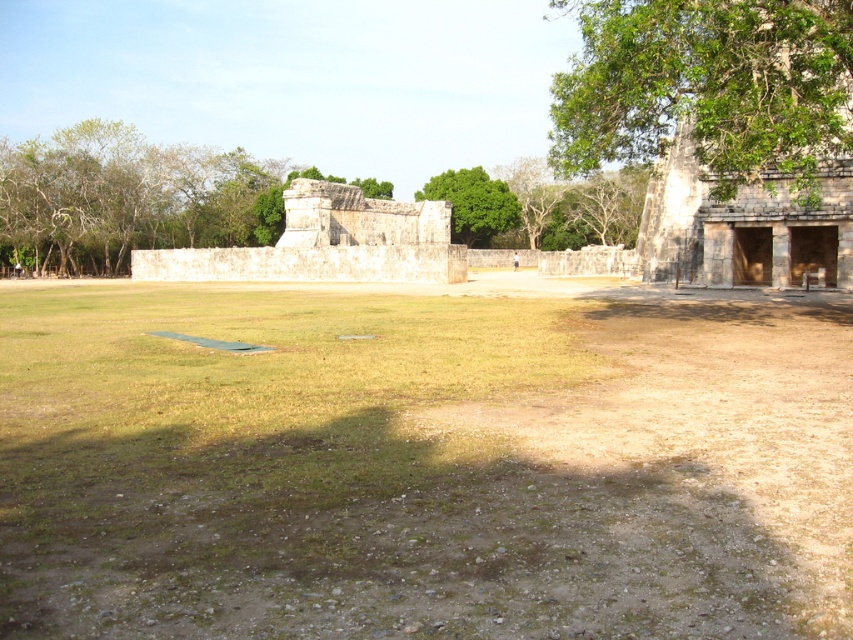
Question: Which object is farther from the camera taking this photo?

Choices:
 (A) brown/dry soil at center
 (B) stone/brick ruins at right
 (C) stone ruins at center

Answer: (C)

Question: Does brown/dry soil at center appear under stone ruins at center?

Choices:
 (A) no
 (B) yes

Answer: (B)

Question: Does stone/brick ruins at right have a greater width compared to stone ruins at center?

Choices:
 (A) yes
 (B) no

Answer: (B)

Question: Does brown/dry soil at center appear under green leafy tree at center?

Choices:
 (A) no
 (B) yes

Answer: (B)

Question: Among these points, which one is nearest to the camera?

Choices:
 (A) (788, 99)
 (B) (438, 182)

Answer: (A)

Question: Which point is closer to the camera?

Choices:
 (A) green leafy tree at left
 (B) stone/brick ruins at right

Answer: (B)